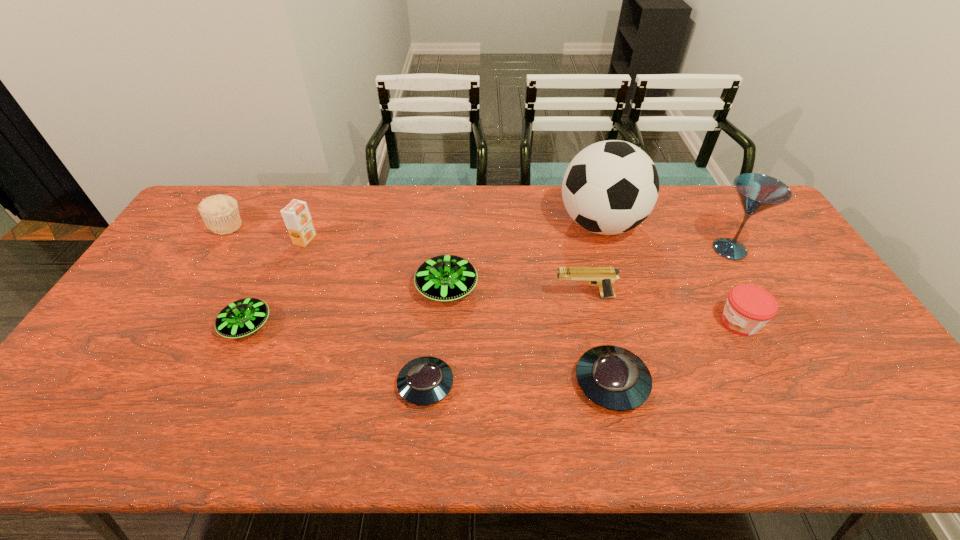
Where is `the bigger green saucer`? This screenshot has height=540, width=960. the bigger green saucer is located at coordinates (444, 278).

Image resolution: width=960 pixels, height=540 pixels. I want to click on the smaller green saucer, so click(x=243, y=317).

Find the location of a particular element. the leftmost saucer is located at coordinates (243, 317).

This screenshot has height=540, width=960. I want to click on the right gray saucer, so click(x=614, y=378).

Identify the location of the bigger gray saucer. Image resolution: width=960 pixels, height=540 pixels. coord(614,378).

This screenshot has height=540, width=960. I want to click on the left gray saucer, so click(x=423, y=381).

This screenshot has height=540, width=960. Find the location of `the smaller gray saucer`. the smaller gray saucer is located at coordinates (423, 381).

Locate an element on the screen. This screenshot has height=540, width=960. vacant space located 0.050m on the left of the tallest object is located at coordinates (542, 225).

The image size is (960, 540). In order to click on vacant space located on the left of the ninth shortest object in this screenshot , I will do `click(668, 249)`.

The image size is (960, 540). I want to click on free location located 0.090m on the back of the orange juice, so click(x=316, y=215).